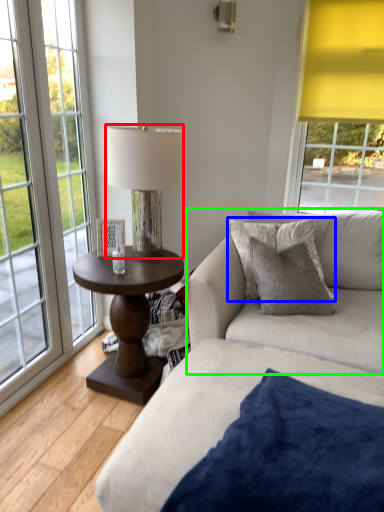
Question: Which object is positioned closest to lamp (highlighted by a red box)? Select from pillow (highlighted by a blue box) and couch (highlighted by a green box).

Choices:
 (A) pillow
 (B) couch

Answer: (A)